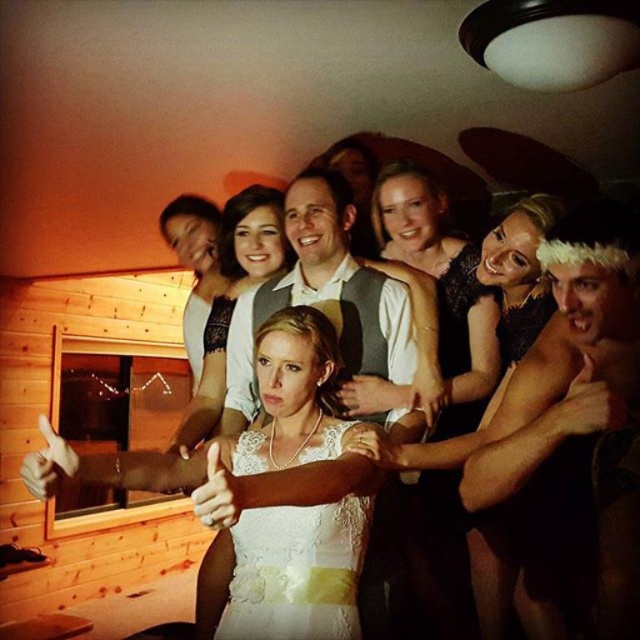
You are a photographer at a wedding reception in a wooden cabin. You notice the shiny gold chain at upper center and the white textured shirt at center. Which object is positioned to the right of the other?

The shiny gold chain at upper center is to the right of the white textured shirt at center.

You are a photographer trying to capture the shiny gold chain at upper center in the image. The camera you are using has a rectangular viewfinder with coordinates from 0 to 1 on both the x and y axes. To ensure the chain is centered in your shot, what coordinates should you aim for?

The shiny gold chain at upper center is located at point (573, 428), so you should aim for those coordinates to center it in your viewfinder.

You are a photographer setting up for a wedding photo shoot in the cabin. You need to ensure that the shiny gold chain at upper center and the white lace dress at center are both visible in the frame. Given their sizes, which object should you prioritize framing closer to avoid cropping?

The shiny gold chain at upper center has a larger width than the white lace dress at center, so you should prioritize framing the shiny gold chain at upper center closer to avoid cropping since it requires more space.